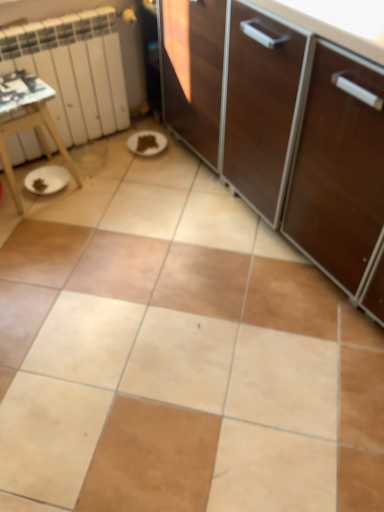
Where is `free space underneath white matte radiator at left (from a real-world perspective)`? The image size is (384, 512). free space underneath white matte radiator at left (from a real-world perspective) is located at coordinates (100, 139).